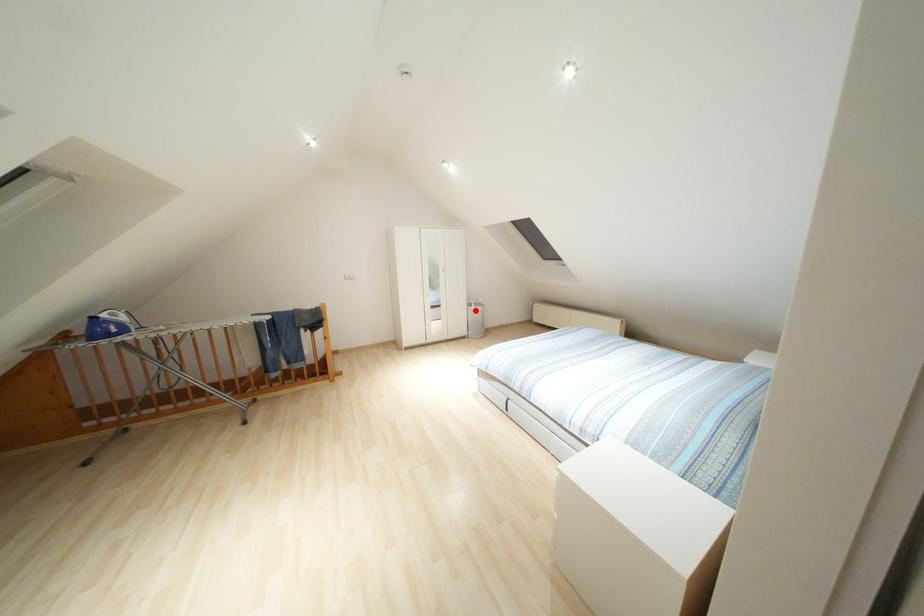
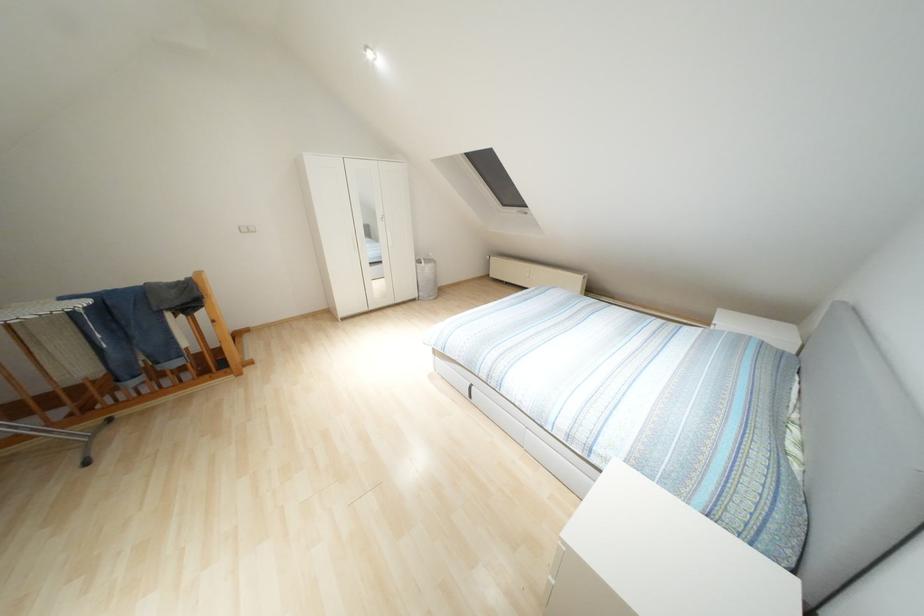
Question: I am providing you with two images of the same scene from different viewpoints. A red point is marked on the first image. Is the red point's position out of view in image 2?

Choices:
 (A) Yes
 (B) No

Answer: (B)